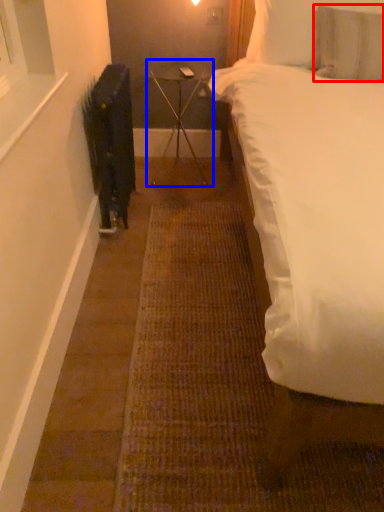
Question: Which point is further to the camera, pillow (highlighted by a red box) or table (highlighted by a blue box)?

Choices:
 (A) pillow
 (B) table

Answer: (B)